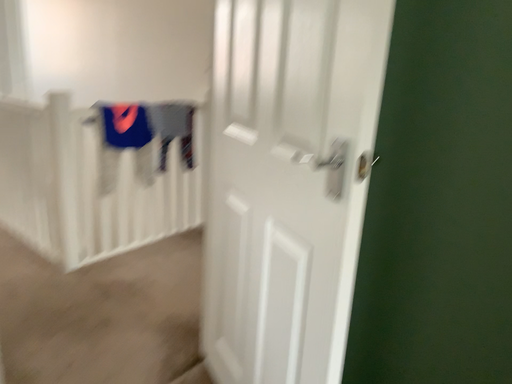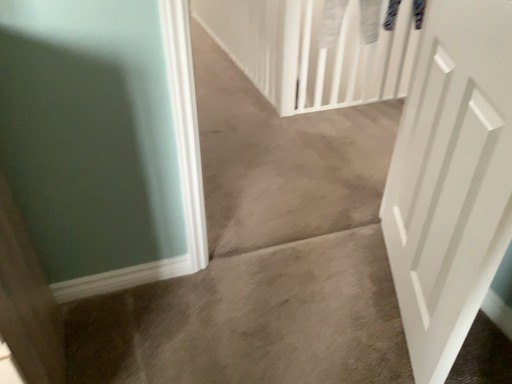
Question: How did the camera likely rotate when shooting the video?

Choices:
 (A) rotated upward
 (B) rotated downward

Answer: (B)